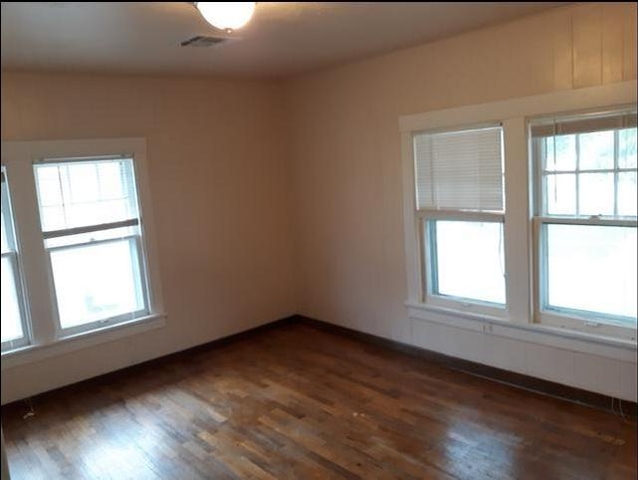
In order to click on window sill in this screenshot , I will do [463, 315], [115, 324], [11, 349], [593, 337].